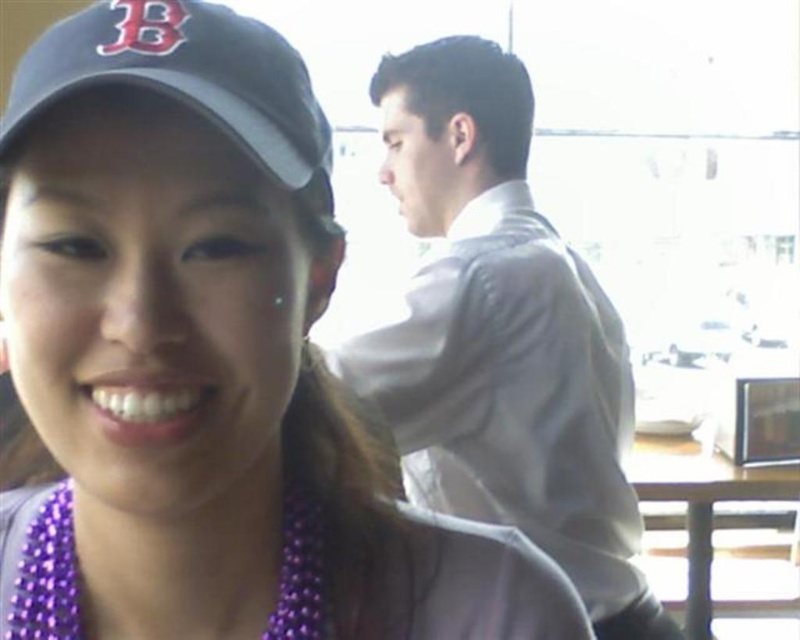
Question: Is white smooth shirt at upper center to the right of black fabric baseball cap at upper left from the viewer's perspective?

Choices:
 (A) no
 (B) yes

Answer: (B)

Question: Does black fabric baseball cap at upper left have a lesser width compared to purple beaded necklace at lower left?

Choices:
 (A) no
 (B) yes

Answer: (B)

Question: Which of the following is the closest to the observer?

Choices:
 (A) (570, 532)
 (B) (326, 522)

Answer: (B)

Question: Which point is farther from the camera taking this photo?

Choices:
 (A) (196, 54)
 (B) (68, 515)
 (C) (520, 372)
 (D) (64, 582)

Answer: (C)

Question: Which point is farther to the camera?

Choices:
 (A) purple beaded necklace at center
 (B) purple beaded necklace at lower left
 (C) white smooth shirt at upper center
 (D) black fabric baseball cap at upper left

Answer: (C)

Question: Is purple beaded necklace at center positioned before black fabric baseball cap at upper left?

Choices:
 (A) no
 (B) yes

Answer: (B)